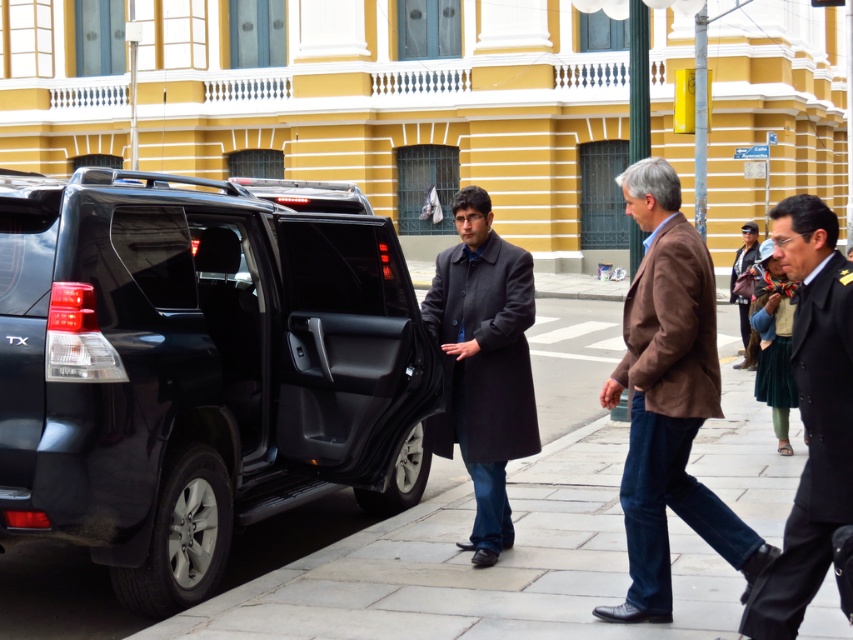
You are a delivery person who needs to place a package on the shiny black minivan at center. The coordinates for the package drop point are given as point [199,368]. Where exactly on the shiny black minivan at center should you place the package?

The point [199,368] is located on the shiny black minivan at center, so place the package at that coordinate on the vehicle.

What are the coordinates of the shiny black minivan at center?

The coordinates of the shiny black minivan at center are at point (199, 368).